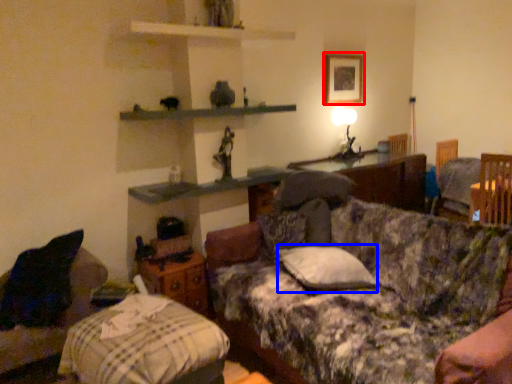
Question: Which point is further to the camera, picture frame (highlighted by a red box) or pillow (highlighted by a blue box)?

Choices:
 (A) picture frame
 (B) pillow

Answer: (A)